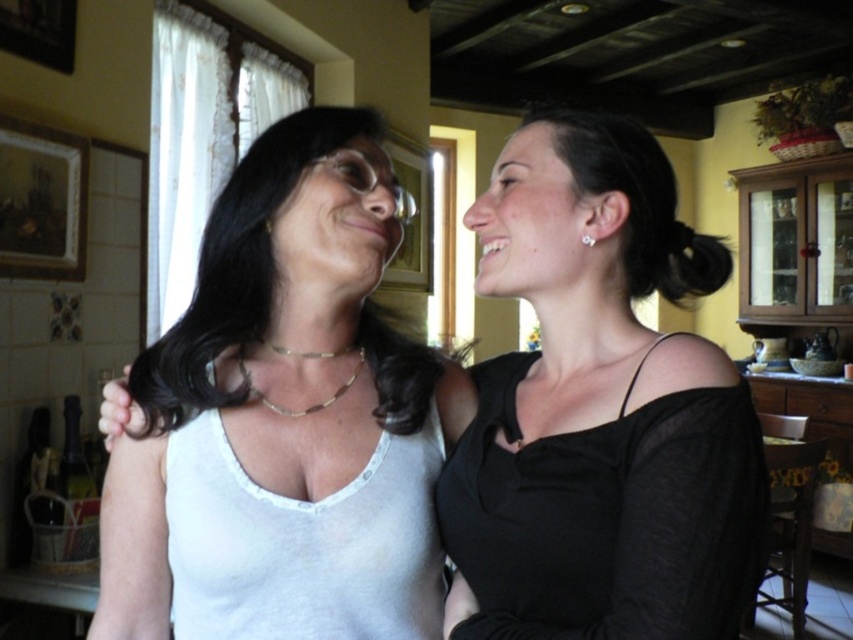
Question: Is silver metallic earring at upper right above gold metallic necklace at upper center?

Choices:
 (A) yes
 (B) no

Answer: (B)

Question: Among these points, which one is nearest to the camera?

Choices:
 (A) (265, 225)
 (B) (323, 161)

Answer: (B)

Question: Can you confirm if black sheer dress at right is positioned to the right of silver metallic earring at upper right?

Choices:
 (A) yes
 (B) no

Answer: (B)

Question: Which of these objects is positioned farthest from the silver metallic earring at upper right?

Choices:
 (A) gold metallic necklace at upper center
 (B) black sheer dress at right
 (C) white matte tank top at center

Answer: (C)

Question: Is gold chain necklace at center above silver metallic earring at upper right?

Choices:
 (A) yes
 (B) no

Answer: (B)

Question: Which object is positioned closest to the silver metallic earring at upper right?

Choices:
 (A) gold metallic necklace at upper center
 (B) gold chain necklace at center
 (C) black sheer dress at right

Answer: (C)